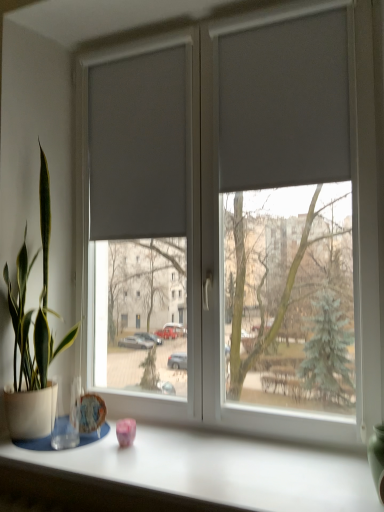
Question: From the image's perspective, would you say matte gray blinds at center is shown under white matte table at lower center?

Choices:
 (A) yes
 (B) no

Answer: (B)

Question: From a real-world perspective, is matte gray blinds at center under white matte table at lower center?

Choices:
 (A) no
 (B) yes

Answer: (A)

Question: Considering the relative sizes of matte gray blinds at center and white matte table at lower center in the image provided, is matte gray blinds at center taller than white matte table at lower center?

Choices:
 (A) yes
 (B) no

Answer: (A)

Question: Considering the relative sizes of matte gray blinds at center and white matte table at lower center in the image provided, is matte gray blinds at center thinner than white matte table at lower center?

Choices:
 (A) no
 (B) yes

Answer: (B)

Question: Is matte gray blinds at center positioned behind white matte table at lower center?

Choices:
 (A) yes
 (B) no

Answer: (A)

Question: In the image, is matte gray curtain at left, which is the 2th curtain from front to back, positioned in front of or behind white matte table at lower center?

Choices:
 (A) behind
 (B) front

Answer: (A)

Question: Is matte gray curtain at left, which is counted as the second curtain, starting from the right, situated inside white matte table at lower center or outside?

Choices:
 (A) outside
 (B) inside

Answer: (A)

Question: In terms of size, does matte gray curtain at left, the 1th curtain when ordered from back to front, appear bigger or smaller than white matte table at lower center?

Choices:
 (A) small
 (B) big

Answer: (A)

Question: Is matte gray curtain at left, the 1th curtain when ordered from back to front, wider or thinner than white matte table at lower center?

Choices:
 (A) thin
 (B) wide

Answer: (A)

Question: Is point (379, 485) positioned closer to the camera than point (24, 344)?

Choices:
 (A) closer
 (B) farther

Answer: (A)

Question: Is green matte glass vase at right spatially inside green glossy plant at left, or outside of it?

Choices:
 (A) outside
 (B) inside

Answer: (A)

Question: From a real-world perspective, is green matte glass vase at right physically located above or below green glossy plant at left?

Choices:
 (A) above
 (B) below

Answer: (B)

Question: Is green matte glass vase at right taller or shorter than green glossy plant at left?

Choices:
 (A) tall
 (B) short

Answer: (B)

Question: Based on their sizes in the image, would you say white matte table at lower center is bigger or smaller than matte gray curtain at left, which is the 2th curtain from front to back?

Choices:
 (A) big
 (B) small

Answer: (A)

Question: Is white matte table at lower center spatially inside matte gray curtain at left, the 1th curtain when ordered from back to front, or outside of it?

Choices:
 (A) outside
 (B) inside

Answer: (A)